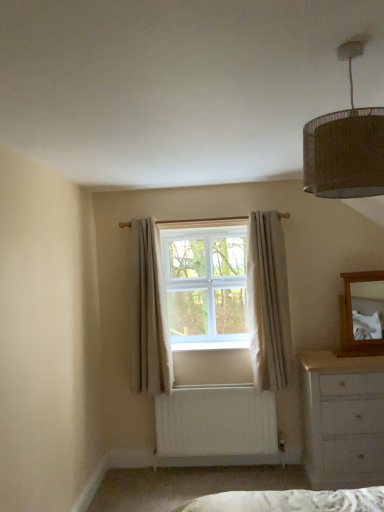
Question: Is white painted wood chest of drawers at lower right wider or thinner than white textured curtain at center, the first curtain viewed from the right?

Choices:
 (A) thin
 (B) wide

Answer: (B)

Question: From a real-world perspective, is white painted wood chest of drawers at lower right positioned above or below white textured curtain at center, the first curtain viewed from the right?

Choices:
 (A) below
 (B) above

Answer: (A)

Question: Which object is positioned closest to the white plastic window at center?

Choices:
 (A) wooden mirror at right
 (B) white painted wood chest of drawers at lower right
 (C) braided wicker lampshade at upper right
 (D) white textured curtain at center, which is counted as the 2th curtain, starting from the left
 (E) light beige fabric curtain at center, positioned as the 1th curtain in left-to-right order

Answer: (E)

Question: Considering the real-world distances, which object is closest to the white plastic window at center?

Choices:
 (A) white textured curtain at center, which is counted as the 2th curtain, starting from the left
 (B) braided wicker lampshade at upper right
 (C) white painted wood chest of drawers at lower right
 (D) wooden mirror at right
 (E) light beige fabric curtain at center, positioned as the 1th curtain in left-to-right order

Answer: (E)